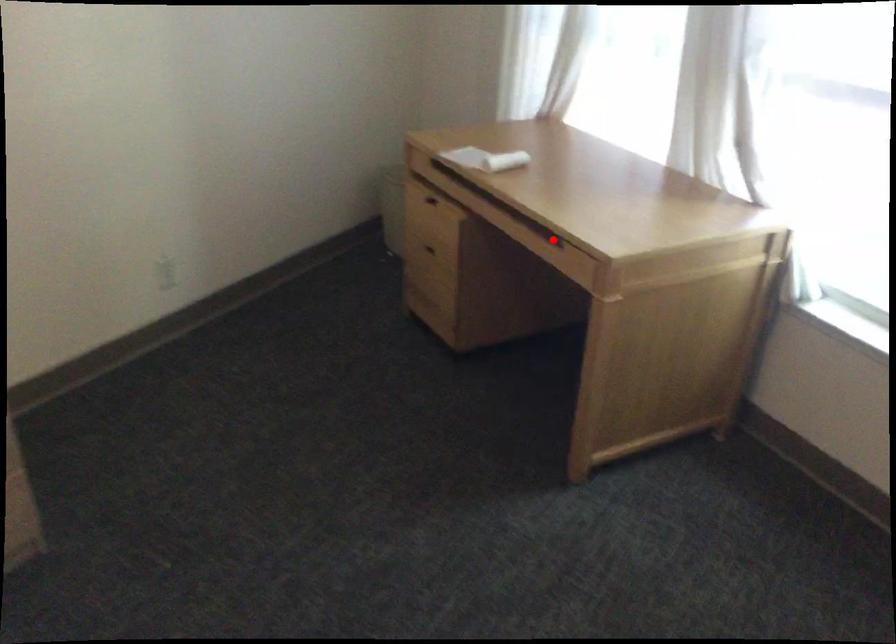
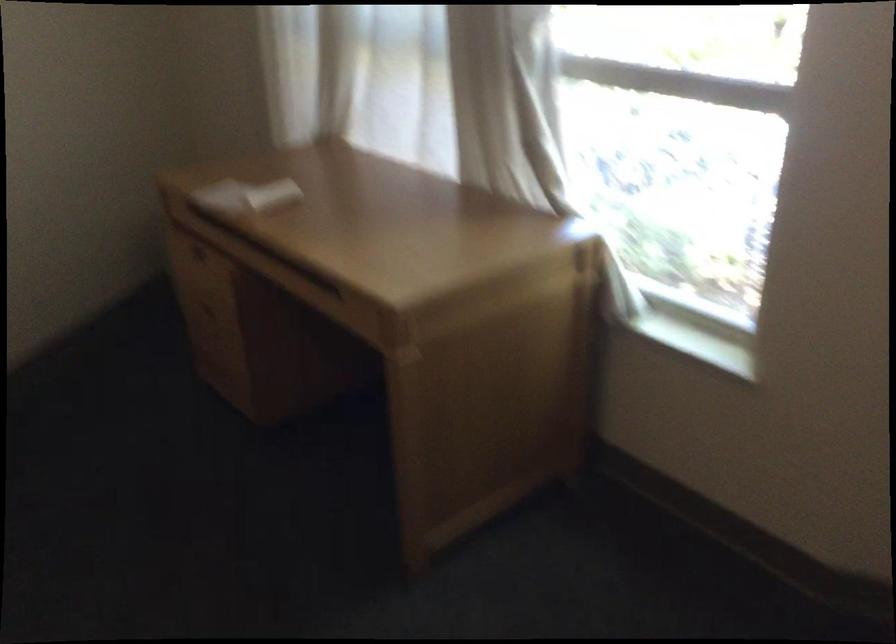
In the second image, find the point that corresponds to the highlighted location in the first image.

(332, 289)